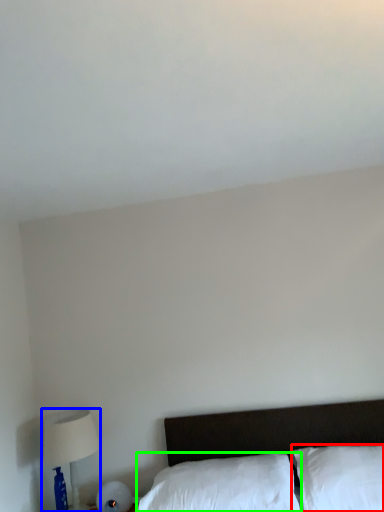
Question: Which is nearer to the pillow (highlighted by a red box)? table lamp (highlighted by a blue box) or pillow (highlighted by a green box).

Choices:
 (A) table lamp
 (B) pillow

Answer: (B)